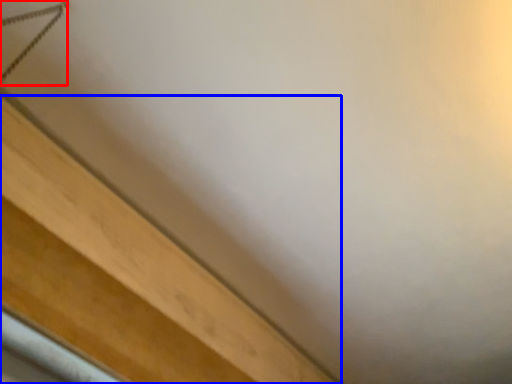
Question: Which object is further to the camera taking this photo, twin (highlighted by a red box) or furniture (highlighted by a blue box)?

Choices:
 (A) twin
 (B) furniture

Answer: (B)